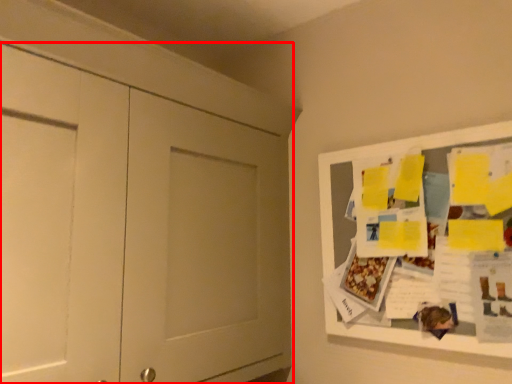
Question: From the image, what is the correct spatial relationship of door (annotated by the red box) in relation to bulletin board?

Choices:
 (A) left
 (B) right

Answer: (A)